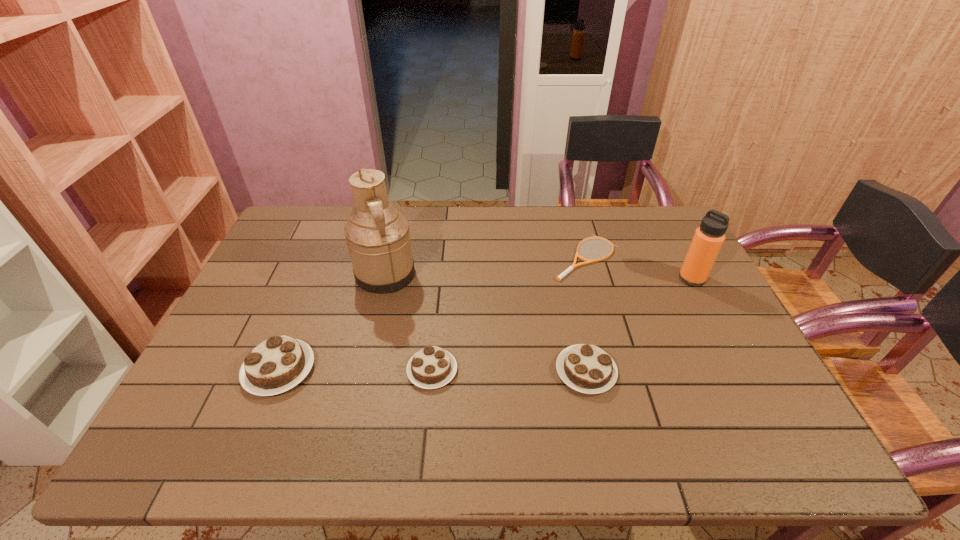
Find the location of a particular element. This screenshot has height=540, width=960. free space that satisfies the following two spatial constraints: 1. on the front side of the fourth object from right to left; 2. on the right side of the second shortest chocolate cake is located at coordinates (432, 372).

The height and width of the screenshot is (540, 960). I want to click on blank space that satisfies the following two spatial constraints: 1. on the back side of the rightmost object; 2. on the left side of the second tallest chocolate cake, so click(565, 279).